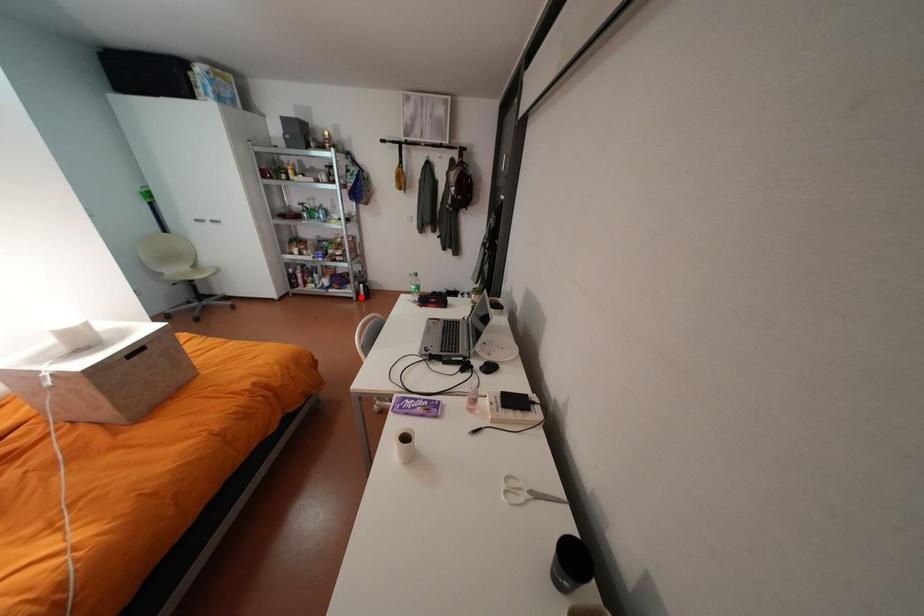
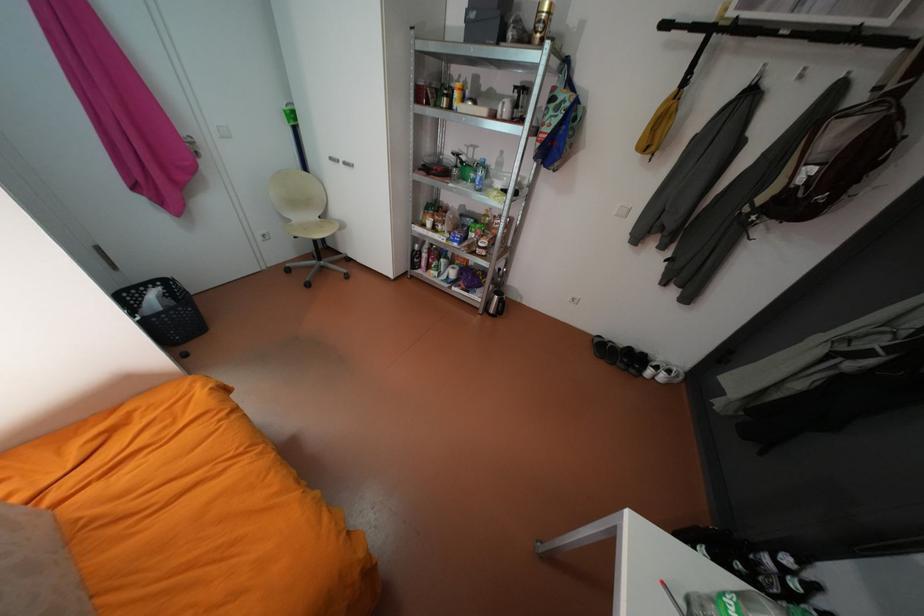
Question: I am providing you with two images of the same scene from different viewpoints. A red point is marked on the first image. Can you still see the location of the red point in image 2?

Choices:
 (A) Yes
 (B) No

Answer: (A)